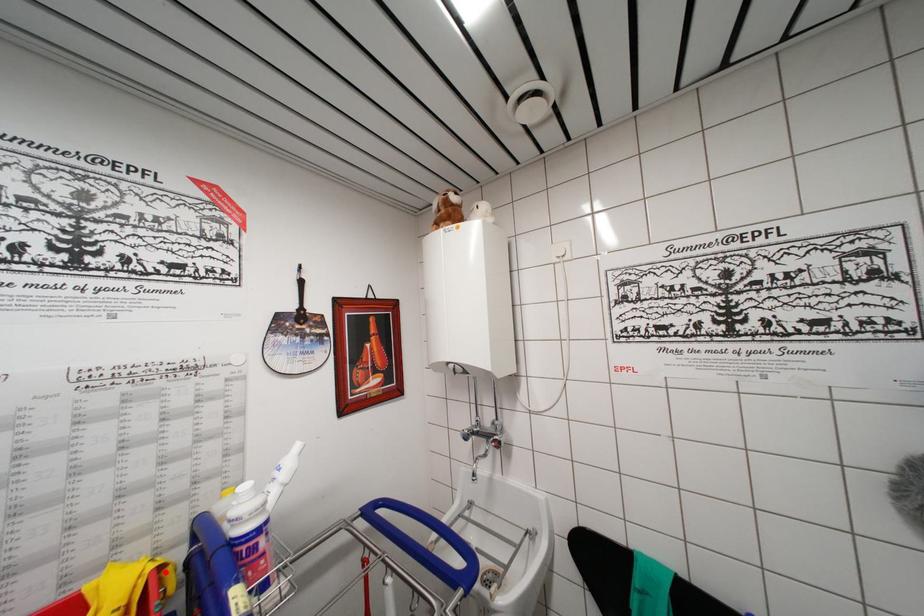
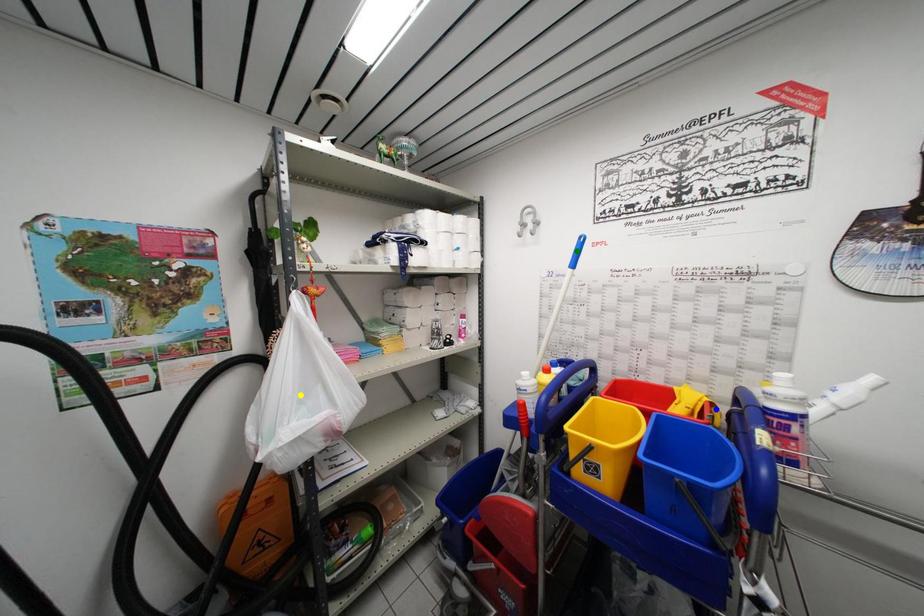
Question: I am providing you with two images of the same scene from different viewpoints. A red point is marked on the first image. You are given multiple points on the second image. Which point in image 2 represents the same 3d spot as the red point in image 1?

Choices:
 (A) green point
 (B) blue point
 (C) yellow point

Answer: (B)